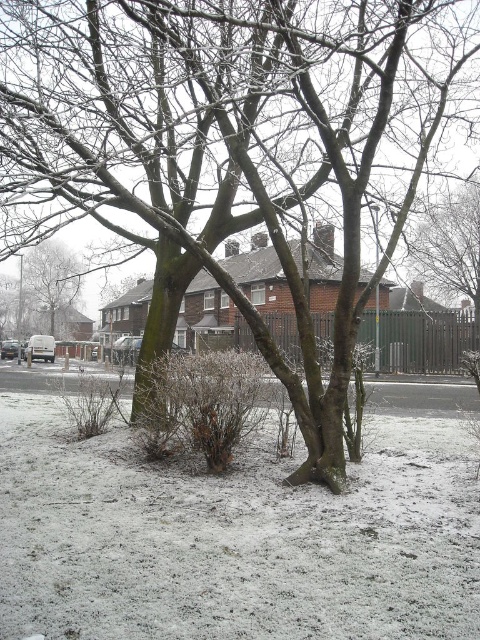
Question: Among these points, which one is nearest to the camera?

Choices:
 (A) [x=92, y=388]
 (B) [x=51, y=257]

Answer: (A)

Question: Can you confirm if snow-covered branches at upper center is wider than smooth brown tree trunk at upper left?

Choices:
 (A) no
 (B) yes

Answer: (B)

Question: Is smooth brown tree trunk at upper left wider than brown textured bush at lower left?

Choices:
 (A) no
 (B) yes

Answer: (B)

Question: Which point is farther from the camera taking this photo?

Choices:
 (A) (83, 385)
 (B) (207, 388)
 (C) (478, 184)
 (D) (72, 339)

Answer: (D)

Question: Among these objects, which one is farthest from the camera?

Choices:
 (A) brown/dry bush at center
 (B) smooth brown tree trunk at upper left
 (C) snow-covered branches at upper center
 (D) brown textured bush at lower left

Answer: (B)

Question: Observing the image, what is the correct spatial positioning of smooth brown tree trunk at upper left in reference to brown textured bush at lower left?

Choices:
 (A) left
 (B) right

Answer: (A)